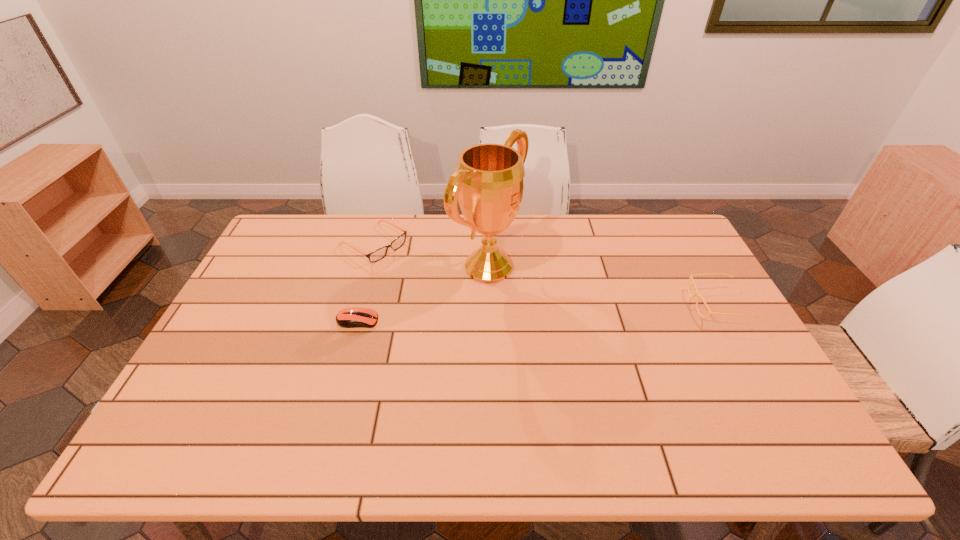
Locate an element on the screen. free space at the near edge of the desktop is located at coordinates (664, 402).

Identify the location of blank area at the right edge. (763, 370).

This screenshot has width=960, height=540. In order to click on vacant area at the far left corner of the desktop in this screenshot , I will do `click(305, 230)`.

Where is `vacant space that's between the left spectacles and the second object from right to left`? The image size is (960, 540). vacant space that's between the left spectacles and the second object from right to left is located at coordinates (431, 255).

This screenshot has height=540, width=960. Identify the location of vacant space that's between the award and the farther spectacles. (431, 255).

This screenshot has height=540, width=960. Identify the location of blank region between the tallest object and the right spectacles. (603, 286).

At what (x,y) coordinates should I click in order to perform the action: click on empty location between the right spectacles and the computer mouse. Please return your answer as a coordinate pair (x, y). Looking at the image, I should click on (538, 312).

Where is `unoccupied position between the farther spectacles and the rightmost object`? unoccupied position between the farther spectacles and the rightmost object is located at coordinates (545, 274).

The image size is (960, 540). I want to click on free point between the award and the left spectacles, so click(431, 255).

Where is `free space between the farther spectacles and the nearer spectacles`? The height and width of the screenshot is (540, 960). free space between the farther spectacles and the nearer spectacles is located at coordinates (545, 274).